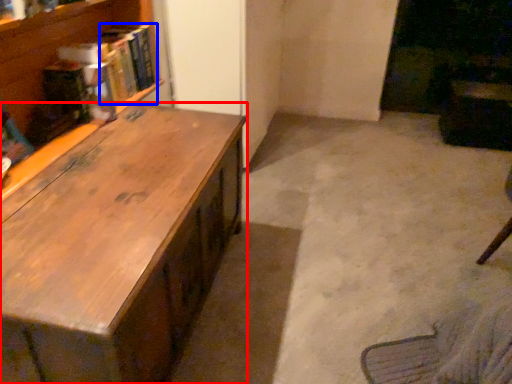
Question: Which point is further to the camera, desk (highlighted by a red box) or book (highlighted by a blue box)?

Choices:
 (A) desk
 (B) book

Answer: (B)